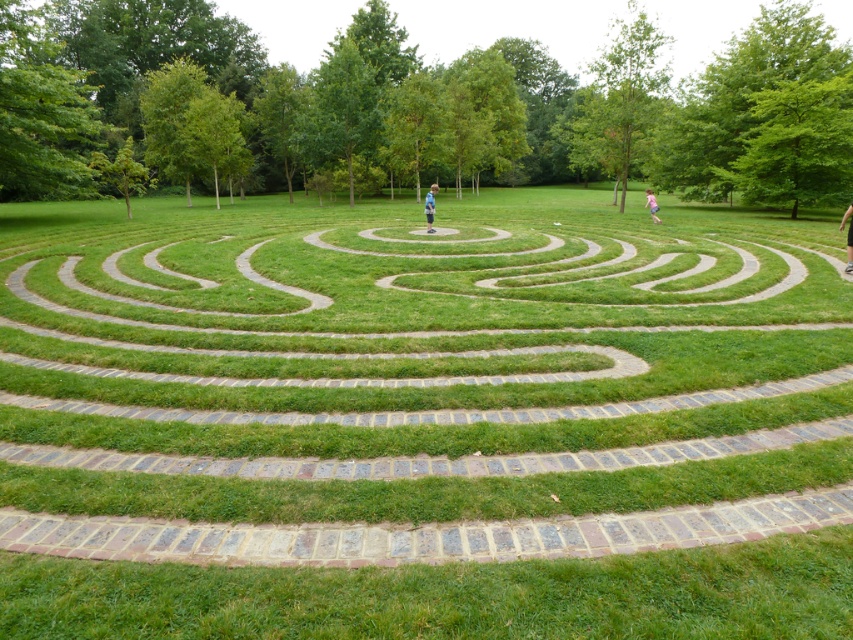
You are a gardener who needs to mow the lawn. You see the green grass at center and the blue denim jeans at center in the labyrinth. Which area should you mow first based on their height?

The green grass at center is shorter than the blue denim jeans at center, so you should mow the area with the green grass at center first since it requires less effort.

You are standing at the entrance of the grassy labyrinth and see two people ahead. One is wearing dark gray pants at center and the other is wearing a blurred white shirt at upper center. Which person is positioned more to the east?

The dark gray pants at center is to the right of blurred white shirt at upper center, so the dark gray pants at center is positioned more to the east.